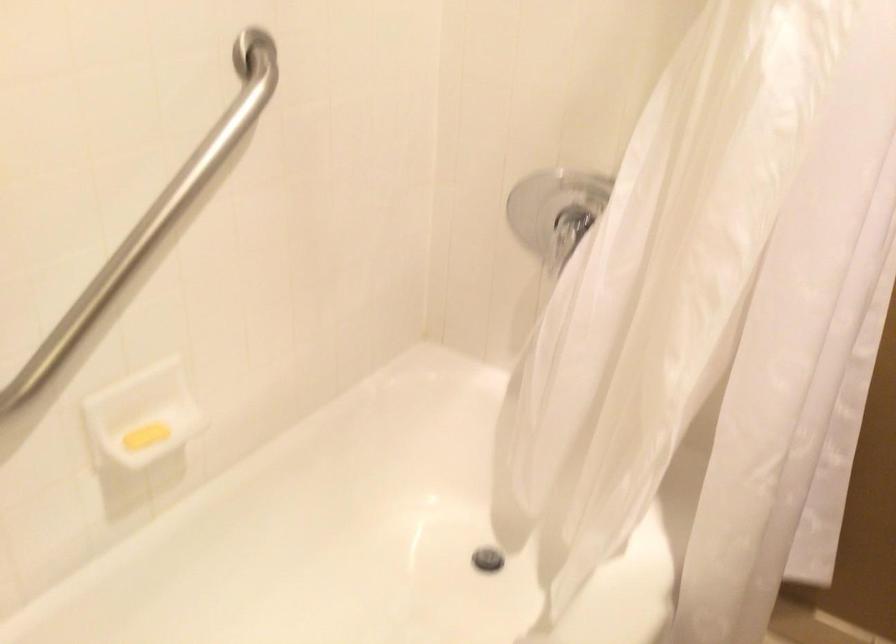
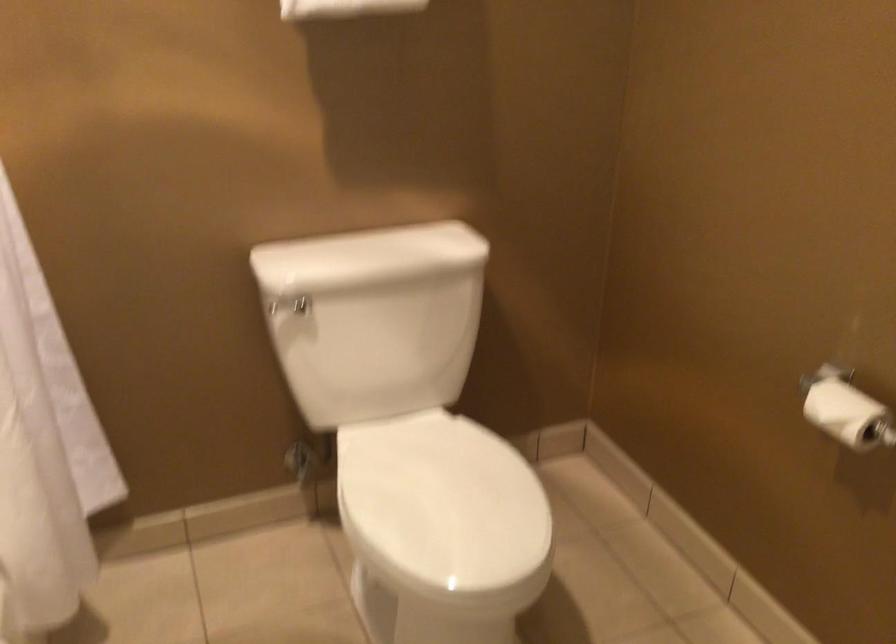
Where in the second image is the point corresponding to pixel 781 500 from the first image?

(44, 444)